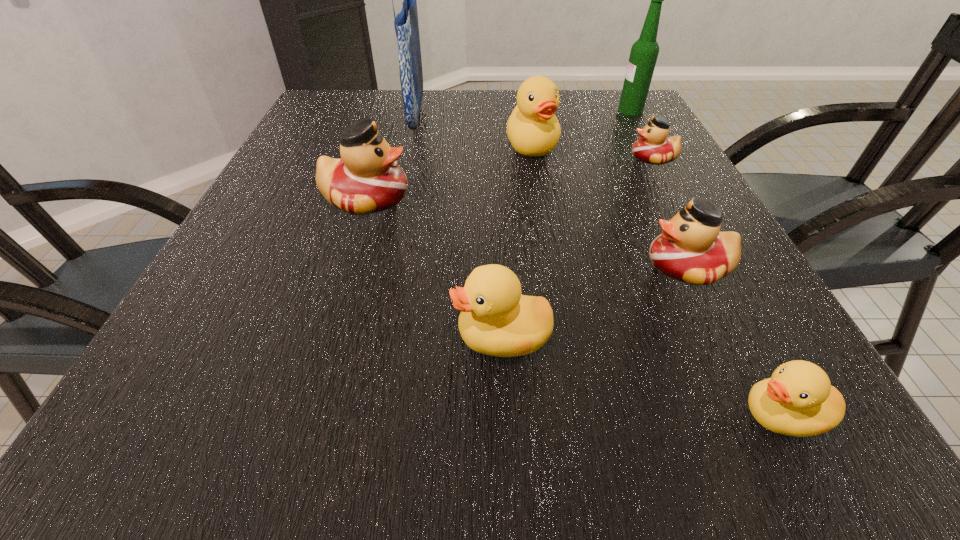
You are a GUI agent. You are given a task and a screenshot of the screen. Output one action in this format:
    pyautogui.click(x=<x>, y=<y>)
    Task: Click on the free space located at the beak of the rightmost yellow duck
    The height and width of the screenshot is (540, 960).
    Given the screenshot: What is the action you would take?
    pyautogui.click(x=646, y=415)

Where is `shopping bag at the far edge`? This screenshot has height=540, width=960. shopping bag at the far edge is located at coordinates (406, 25).

Where is `beer bottle located at the far edge`? The image size is (960, 540). beer bottle located at the far edge is located at coordinates (644, 52).

I want to click on duck at the far edge, so click(533, 130).

Find the location of `object located at the near edge`. object located at the near edge is located at coordinates (798, 400).

The image size is (960, 540). Identify the location of object located at the left edge. (366, 179).

Identify the location of beer bottle at the right edge. (644, 52).

Where is `object present at the far right corner`? object present at the far right corner is located at coordinates (644, 52).

You are a GUI agent. You are given a task and a screenshot of the screen. Output one action in this format:
    pyautogui.click(x=<x>, y=<y>)
    Task: Click on the object situated at the near right corner
    
    Given the screenshot: What is the action you would take?
    pyautogui.click(x=798, y=400)

At what (x,y) coordinates should I click in order to perform the action: click on vacant space at the far edge of the desktop. Please return your answer as a coordinate pair (x, y). The height and width of the screenshot is (540, 960). Looking at the image, I should click on (516, 99).